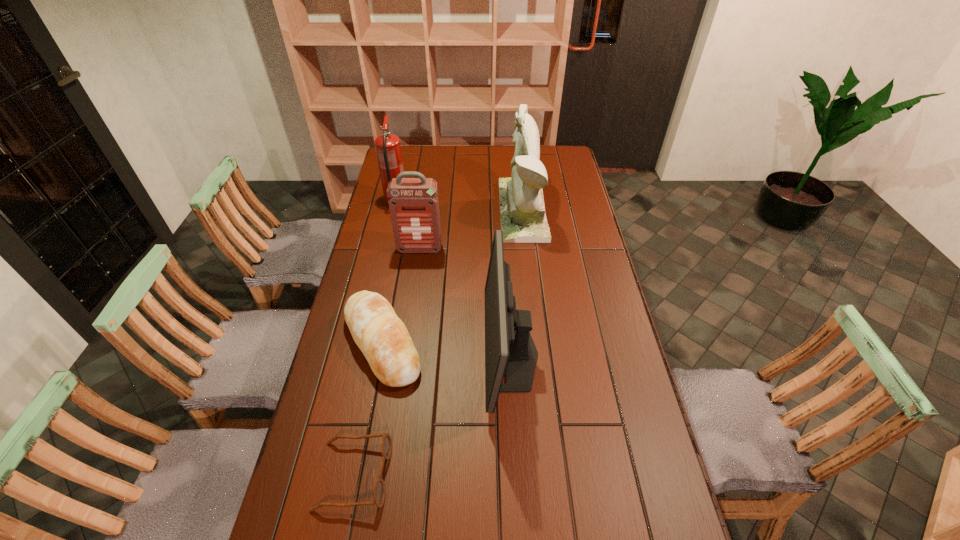
Locate an element on the screen. object that can be found as the closest to the sculpture is located at coordinates (413, 202).

Image resolution: width=960 pixels, height=540 pixels. I want to click on object that is the closest to the shortest object, so click(x=382, y=337).

Locate an element on the screen. The height and width of the screenshot is (540, 960). vacant point that satisfies the following two spatial constraints: 1. on the base of the sculpture; 2. on the front-facing side of the third farthest object is located at coordinates pyautogui.click(x=527, y=249).